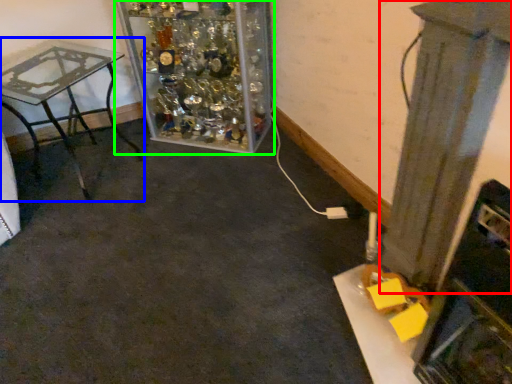
Question: Based on their relative distances, which object is nearer to pillar (highlighted by a red box)? Choose from table (highlighted by a blue box) and furniture (highlighted by a green box).

Choices:
 (A) table
 (B) furniture

Answer: (B)